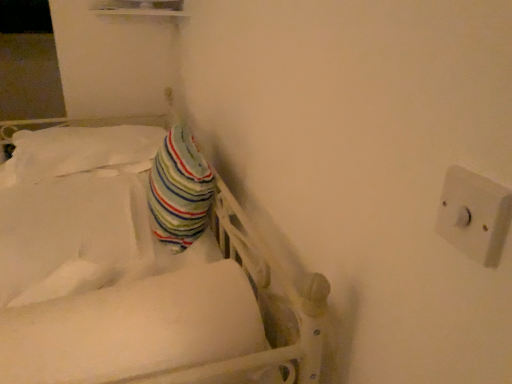
Question: Looking at the image, does striped fabric pillow at center seem bigger or smaller compared to white plastic switch at upper right?

Choices:
 (A) big
 (B) small

Answer: (A)

Question: From a real-world perspective, relative to white plastic switch at upper right, is striped fabric pillow at center vertically above or below?

Choices:
 (A) above
 (B) below

Answer: (B)

Question: Estimate the real-world distances between objects in this image. Which object is closer to the white soft mattress at center?

Choices:
 (A) white plastic switch at upper right
 (B) striped fabric pillow at upper left
 (C) striped fabric pillow at center

Answer: (A)

Question: Based on their relative distances, which object is farther from the white plastic switch at upper right?

Choices:
 (A) striped fabric pillow at center
 (B) white soft mattress at center
 (C) striped fabric pillow at upper left

Answer: (C)